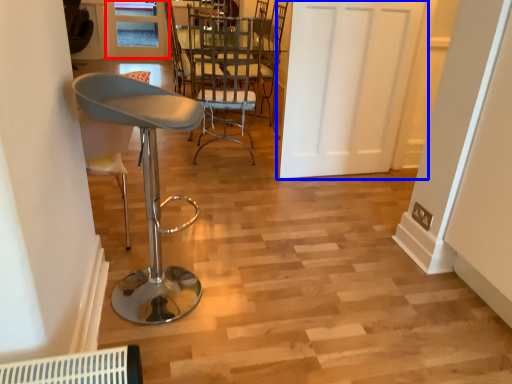
Question: Which object is further to the camera taking this photo, window (highlighted by a red box) or door (highlighted by a blue box)?

Choices:
 (A) window
 (B) door

Answer: (A)